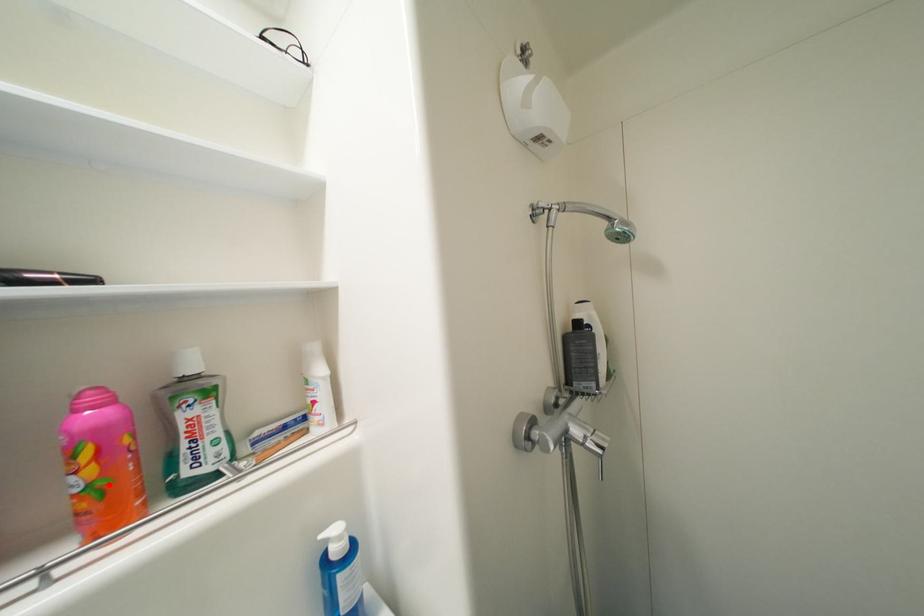
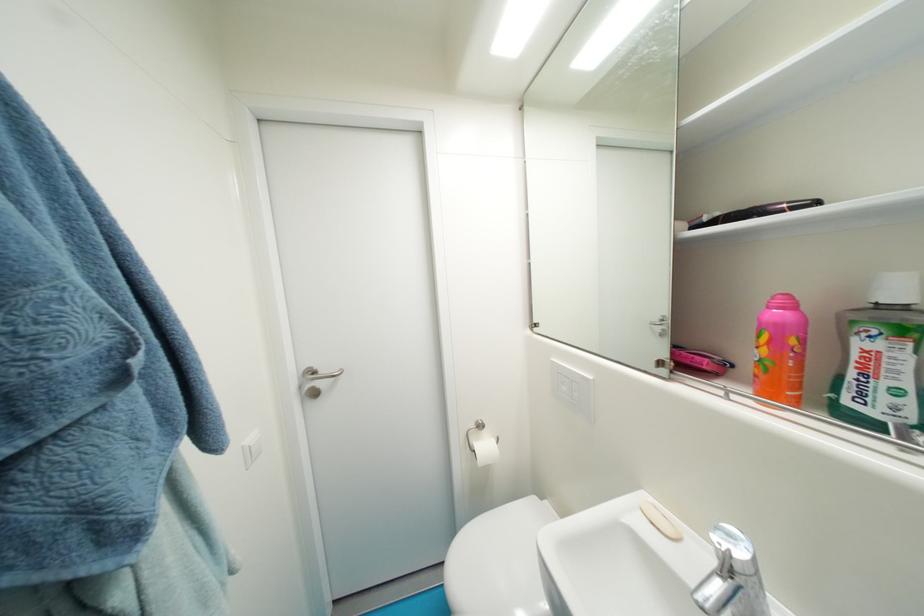
Find the pixel in the second image that matches the highlighted location in the first image.

(774, 363)